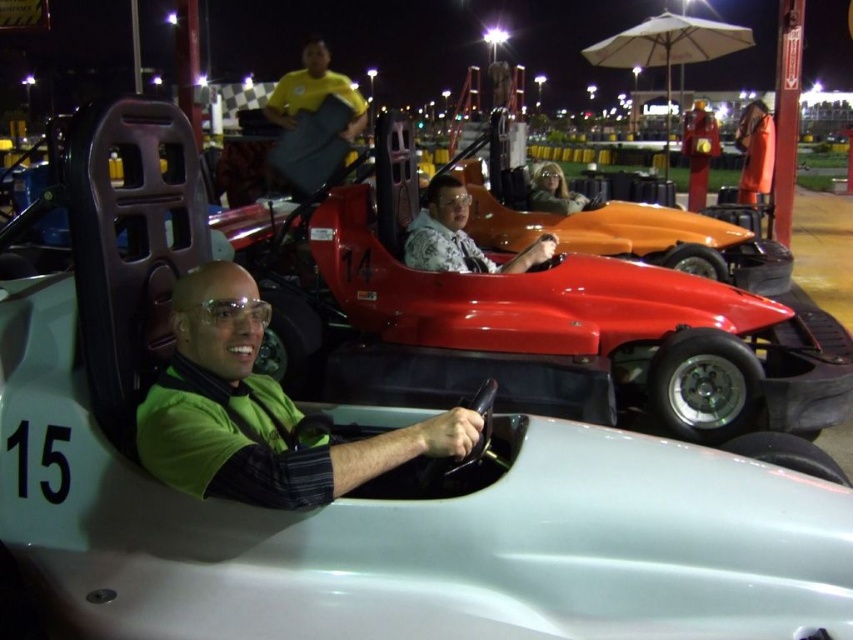
You are a race official trying to determine the starting positions for the go karts. According to the image, where exactly is the shiny red race car at center positioned?

The shiny red race car at center is positioned at coordinates point (552, 316).

You are standing at the origin point in the image. Which object is located at the coordinates point (552, 316)?

The shiny red race car at center is located at point (552, 316).

You are a photographer positioned at the point with coordinates (257, 412) in the image. Looking at the go kart numbered 15 and the go kart numbered 14, which kart is closer to your current position?

The point at coordinates (257, 412) corresponds to the green matte shirt at center. The go kart numbered 15 is closer to your current position since it is in the foreground compared to the go kart numbered 14 which is behind it.